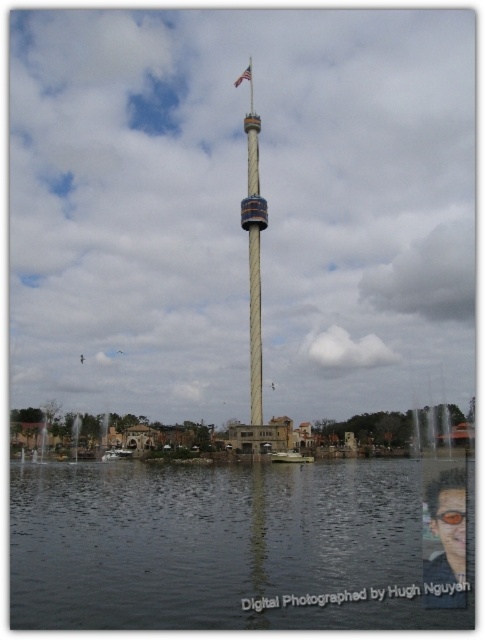
Which is in front, point (254, 500) or point (442, 515)?

Positioned in front is point (442, 515).

Locate an element on the screen. dark reflective water at center is located at coordinates (238, 545).

Who is positioned more to the left, smooth beige tower at center or orange plastic goggles at center?

Positioned to the left is smooth beige tower at center.

Which is behind, point (248, 291) or point (451, 518)?

The point (248, 291) is more distant.

Does point (253, 227) come behind point (447, 516)?

That is True.

The image size is (485, 640). Find the location of `smooth beige tower at center`. smooth beige tower at center is located at coordinates (255, 300).

Between smooth beige tower at center and shiny black sunglasses at lower right, which one appears on the right side from the viewer's perspective?

Positioned to the right is shiny black sunglasses at lower right.

Is smooth beige tower at center to the left of shiny black sunglasses at lower right from the viewer's perspective?

Indeed, smooth beige tower at center is positioned on the left side of shiny black sunglasses at lower right.

Who is more forward, (245, 227) or (446, 589)?

Positioned in front is point (446, 589).

Locate an element on the screen. The width and height of the screenshot is (485, 640). smooth beige tower at center is located at coordinates (255, 300).